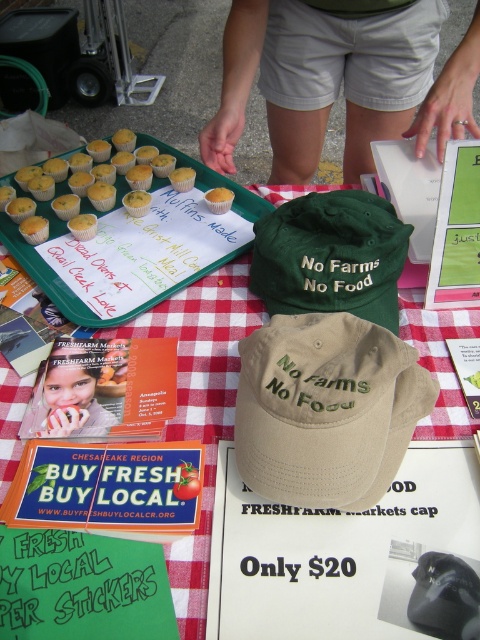
Question: Which object is closer to the camera taking this photo?

Choices:
 (A) tan fabric cap at center
 (B) red checkered tablecloth at center
 (C) green plastic tray at upper left
 (D) green fabric baseball cap at center

Answer: (A)

Question: Does red checkered tablecloth at center come in front of green fabric baseball cap at center?

Choices:
 (A) yes
 (B) no

Answer: (A)

Question: Which object is closer to the camera taking this photo?

Choices:
 (A) tan fabric cap at center
 (B) yellow paper muffin at upper left

Answer: (A)

Question: Among these objects, which one is nearest to the camera?

Choices:
 (A) yellow paper muffin at upper left
 (B) tan fabric cap at center
 (C) green plastic tray at upper left

Answer: (B)

Question: Can you confirm if green fabric baseball cap at center is thinner than yellow paper muffin at upper left?

Choices:
 (A) yes
 (B) no

Answer: (A)

Question: Is green fabric baseball cap at center wider than yellow paper muffin at upper left?

Choices:
 (A) no
 (B) yes

Answer: (A)